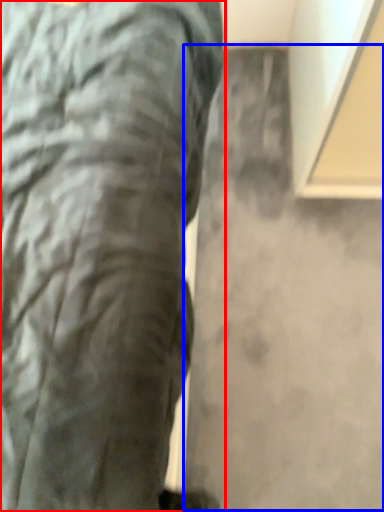
Question: Which object is further to the camera taking this photo, trousers (highlighted by a red box) or concrete (highlighted by a blue box)?

Choices:
 (A) trousers
 (B) concrete

Answer: (B)